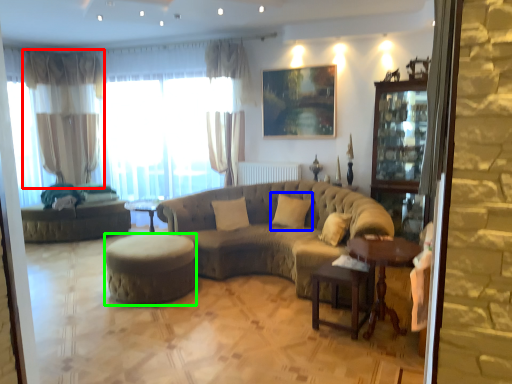
Question: Considering the real-world distances, which object is farthest from curtain (highlighted by a red box)? pillow (highlighted by a blue box) or stool (highlighted by a green box)?

Choices:
 (A) pillow
 (B) stool

Answer: (A)